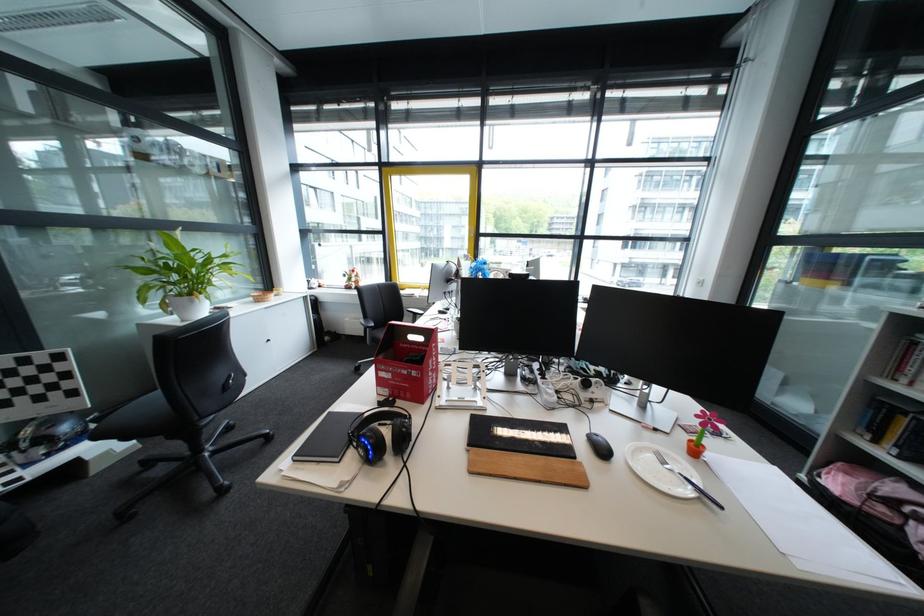
Where would you pull the red box handle? Please return your answer as a coordinate pair (x, y).

(414, 334)